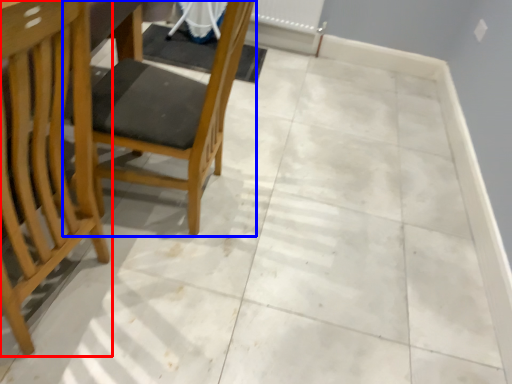
Question: Among these objects, which one is nearest to the camera, chair (highlighted by a red box) or chair (highlighted by a blue box)?

Choices:
 (A) chair
 (B) chair

Answer: (A)